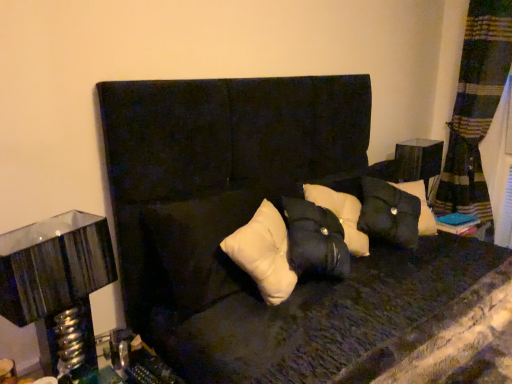
Find the location of a particular element. The image size is (512, 384). metallic silver table lamp at left is located at coordinates (57, 282).

The image size is (512, 384). What do you see at coordinates (248, 220) in the screenshot? I see `velvet black couch at center` at bounding box center [248, 220].

Image resolution: width=512 pixels, height=384 pixels. What are the coordinates of `metallic silver table lamp at left` in the screenshot? It's located at click(57, 282).

From the image's perspective, is metallic silver table lamp at left located beneath matte black side table at right?

Yes, from the image's perspective, metallic silver table lamp at left is beneath matte black side table at right.

Is metallic silver table lamp at left placed right next to matte black side table at right?

No, metallic silver table lamp at left is not beside matte black side table at right.

Which object is further away from the camera taking this photo, metallic silver table lamp at left or matte black side table at right?

matte black side table at right is further away from the camera.

Is metallic silver table lamp at left turned away from matte black side table at right?

No, metallic silver table lamp at left's orientation is not away from matte black side table at right.

Can you confirm if matte black side table at right is positioned to the right of metallic silver table lamp at left?

Correct, you'll find matte black side table at right to the right of metallic silver table lamp at left.

Consider the image. From the image's perspective, is matte black side table at right above or below metallic silver table lamp at left?

matte black side table at right is situated higher than metallic silver table lamp at left in the image.

Which of these two, matte black side table at right or metallic silver table lamp at left, is bigger?

metallic silver table lamp at left is bigger.

Which is closer, (395, 147) or (85, 278)?

Point (395, 147) is farther from the camera than point (85, 278).

Is point (190, 330) positioned before point (405, 155)?

Yes, it is.

Measure the distance from velvet black couch at center to matte black side table at right.

velvet black couch at center is 34.22 inches away from matte black side table at right.

In the image, is velvet black couch at center positioned in front of or behind matte black side table at right?

velvet black couch at center is positioned closer to the viewer than matte black side table at right.

Looking at this image, is velvet black couch at center next to matte black side table at right?

No, velvet black couch at center is not in contact with matte black side table at right.

Considering the positions of point (406, 143) and point (244, 95), is point (406, 143) closer or farther from the camera than point (244, 95)?

Clearly, point (406, 143) is more distant from the camera than point (244, 95).

Is matte black side table at right not close to velvet black couch at center?

No, matte black side table at right is not far from velvet black couch at center.

Considering their positions, is matte black side table at right located in front of or behind velvet black couch at center?

Visually, matte black side table at right is located behind velvet black couch at center.

Is metallic silver table lamp at left oriented away from white matte pillow at center?

No, metallic silver table lamp at left's orientation is not away from white matte pillow at center.

From the image's perspective, does metallic silver table lamp at left appear higher than white matte pillow at center?

Incorrect, from the image's perspective, metallic silver table lamp at left is lower than white matte pillow at center.

Is metallic silver table lamp at left to the left or to the right of white matte pillow at center in the image?

metallic silver table lamp at left is to the left of white matte pillow at center.

Do you think metallic silver table lamp at left is within white matte pillow at center, or outside of it?

metallic silver table lamp at left is not enclosed by white matte pillow at center.

In terms of size, does matte black side table at right appear bigger or smaller than white matte pillow at center?

In the image, matte black side table at right appears to be smaller than white matte pillow at center.

From a real-world perspective, is matte black side table at right on top of white matte pillow at center?

No, from a real-world perspective, matte black side table at right is not over white matte pillow at center

Considering the positions of objects matte black side table at right and white matte pillow at center in the image provided, who is behind, matte black side table at right or white matte pillow at center?

Positioned behind is matte black side table at right.

Is white matte pillow at center surrounded by matte black side table at right?

No.

Between white matte pillow at center and metallic silver table lamp at left, which one has less height?

Standing shorter between the two is white matte pillow at center.

What's the angular difference between white matte pillow at center and metallic silver table lamp at left's facing directions?

The facing directions of white matte pillow at center and metallic silver table lamp at left are 4.25 degrees apart.

Considering the sizes of objects white matte pillow at center and metallic silver table lamp at left in the image provided, who is smaller, white matte pillow at center or metallic silver table lamp at left?

metallic silver table lamp at left.

Is white matte pillow at center with metallic silver table lamp at left?

No, white matte pillow at center is not beside metallic silver table lamp at left.

What are the coordinates of `table lamp that appears on the left of matte black side table at right` in the screenshot? It's located at (57, 282).

The height and width of the screenshot is (384, 512). What are the coordinates of `table above the metallic silver table lamp at left (from the image's perspective)` in the screenshot? It's located at (418, 160).

Which object lies further to the anchor point metallic silver table lamp at left, white matte pillow at center or velvet black couch at center?

velvet black couch at center is further to metallic silver table lamp at left.

Considering their positions, is white matte pillow at center positioned closer to velvet black couch at center than metallic silver table lamp at left?

Based on the image, white matte pillow at center appears to be nearer to velvet black couch at center.

From the picture: Based on their spatial positions, is metallic silver table lamp at left or velvet black couch at center further from matte black side table at right?

The object further to matte black side table at right is metallic silver table lamp at left.

Based on their spatial positions, is matte black side table at right or metallic silver table lamp at left further from white matte pillow at center?

Among the two, matte black side table at right is located further to white matte pillow at center.

From the image, which object appears to be nearer to metallic silver table lamp at left, white matte pillow at center or matte black side table at right?

Among the two, white matte pillow at center is located nearer to metallic silver table lamp at left.

Looking at the image, which one is located further to white matte pillow at center, matte black side table at right or velvet black couch at center?

Among the two, matte black side table at right is located further to white matte pillow at center.

Based on their spatial positions, is velvet black couch at center or white matte pillow at center closer to metallic silver table lamp at left?

The object closer to metallic silver table lamp at left is white matte pillow at center.

From the image, which object appears to be nearer to metallic silver table lamp at left, velvet black couch at center or matte black side table at right?

velvet black couch at center.

Locate an element on the screen. This screenshot has width=512, height=384. pillow positioned between velvet black couch at center and matte black side table at right from near to far is located at coordinates (264, 253).

Locate an element on the screen. The width and height of the screenshot is (512, 384). table lamp between velvet black couch at center and matte black side table at right along the z-axis is located at coordinates (57, 282).

At what (x,y) coordinates should I click in order to perform the action: click on pillow situated between metallic silver table lamp at left and velvet black couch at center from left to right. Please return your answer as a coordinate pair (x, y). This screenshot has width=512, height=384. Looking at the image, I should click on (264, 253).

The height and width of the screenshot is (384, 512). In order to click on pillow between metallic silver table lamp at left and matte black side table at right from left to right in this screenshot , I will do `click(264, 253)`.